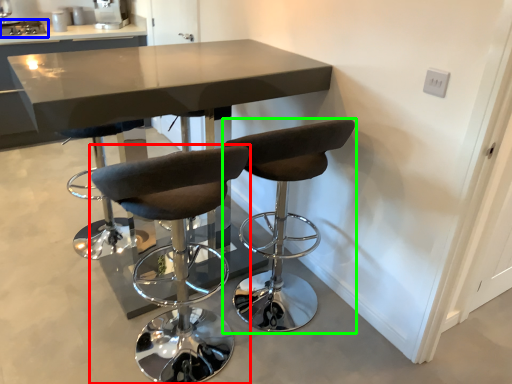
Question: Estimate the real-world distances between objects in this image. Which object is closer to chair (highlighted by a red box), appliance (highlighted by a blue box) or chair (highlighted by a green box)?

Choices:
 (A) appliance
 (B) chair

Answer: (B)